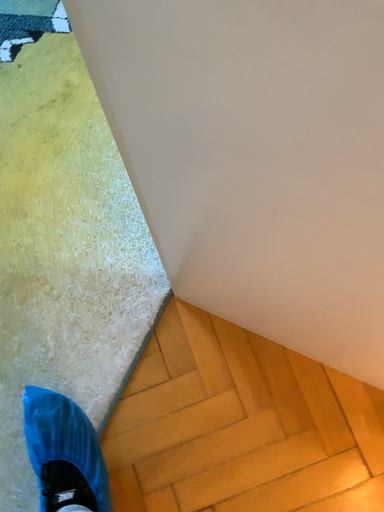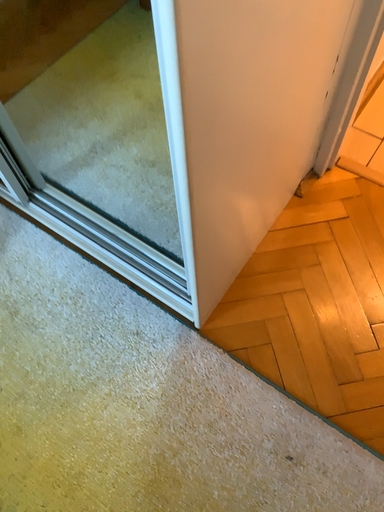
Question: How did the camera likely rotate when shooting the video?

Choices:
 (A) rotated upward
 (B) rotated downward

Answer: (A)